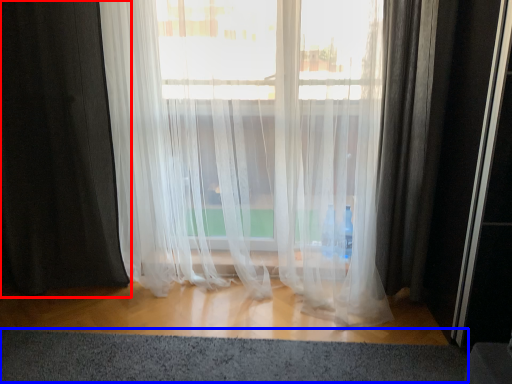
Question: Which of the following is the farthest to the observer, curtain (highlighted by a red box) or gray (highlighted by a blue box)?

Choices:
 (A) curtain
 (B) gray

Answer: (A)